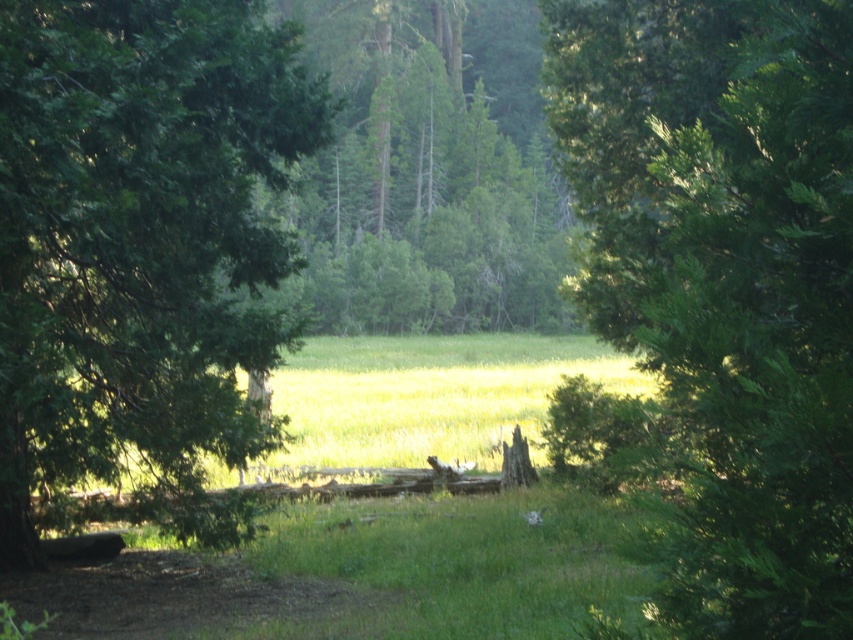
You are a hiker trying to navigate through the forest. You see a green leafy tree at left and a green textured tree at center. Which tree should you walk towards if you want to head towards the center of the clearing?

You should walk towards the green textured tree at center because it is located in the middle of the clearing, so heading towards it would lead you directly to the center.